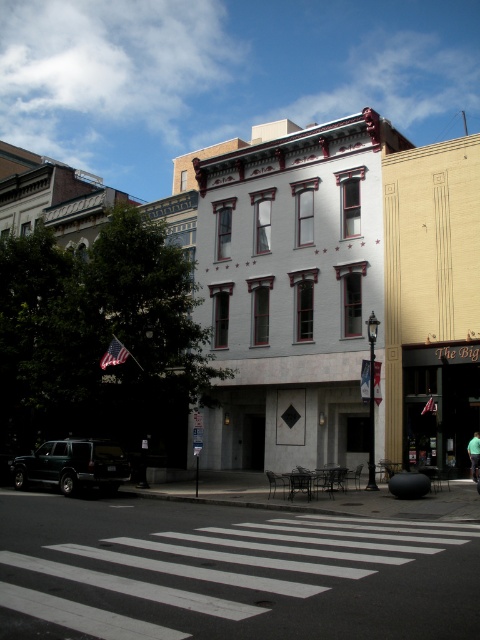
You are a pedestrian standing at the crosswalk. You see a dark green matte suv at lower left. Is the white painted crosswalk at lower center in front of or behind the suv?

The white painted crosswalk at lower center is in front of the dark green matte suv at lower left.

You are a pedestrian standing on the sidewalk at the lower left corner of the image. You want to cross the street to reach the entrance of the three story building. Is the point marked at coordinates point (x=228, y=572) on the crosswalk a safe place to cross?

The point marked at coordinates point (x=228, y=572) is on the white painted crosswalk at lower center, so yes, it is a safe place to cross.

You are a pedestrian standing at the edge of the white painted crosswalk at lower center. You want to cross the street to reach the dark green matte suv at lower left. Is the crosswalk higher than the suv?

The white painted crosswalk at lower center has a greater height compared to the dark green matte suv at lower left, so yes, the crosswalk is higher than the suv.